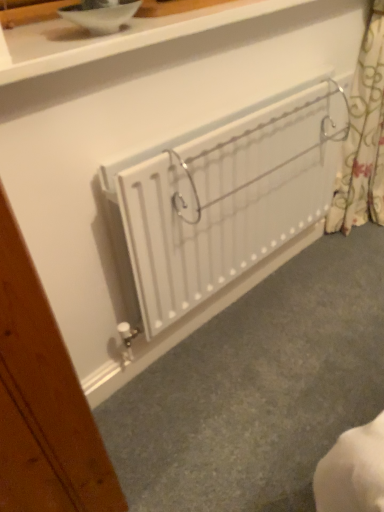
Question: Does white matte radiator at center turn towards floral fabric curtain at right?

Choices:
 (A) no
 (B) yes

Answer: (A)

Question: Considering the relative sizes of white matte radiator at center and floral fabric curtain at right in the image provided, is white matte radiator at center wider than floral fabric curtain at right?

Choices:
 (A) yes
 (B) no

Answer: (B)

Question: Does white matte radiator at center have a lesser height compared to floral fabric curtain at right?

Choices:
 (A) no
 (B) yes

Answer: (B)

Question: Considering the relative sizes of white matte radiator at center and floral fabric curtain at right in the image provided, is white matte radiator at center smaller than floral fabric curtain at right?

Choices:
 (A) yes
 (B) no

Answer: (B)

Question: Is white matte radiator at center taller than floral fabric curtain at right?

Choices:
 (A) yes
 (B) no

Answer: (B)

Question: Is white matte radiator at center not close to floral fabric curtain at right?

Choices:
 (A) yes
 (B) no

Answer: (B)

Question: Does floral fabric curtain at right have a greater height compared to white matte radiator at center?

Choices:
 (A) no
 (B) yes

Answer: (B)

Question: Considering the relative positions of floral fabric curtain at right and white matte radiator at center in the image provided, is floral fabric curtain at right to the right of white matte radiator at center from the viewer's perspective?

Choices:
 (A) no
 (B) yes

Answer: (B)

Question: From the image's perspective, is floral fabric curtain at right located beneath white matte radiator at center?

Choices:
 (A) yes
 (B) no

Answer: (B)

Question: Is floral fabric curtain at right oriented towards white matte radiator at center?

Choices:
 (A) yes
 (B) no

Answer: (B)

Question: Considering the relative positions of floral fabric curtain at right and white matte radiator at center in the image provided, is floral fabric curtain at right to the left of white matte radiator at center from the viewer's perspective?

Choices:
 (A) no
 (B) yes

Answer: (A)

Question: Is white matte radiator at center surrounded by floral fabric curtain at right?

Choices:
 (A) yes
 (B) no

Answer: (B)

Question: Would you say floral fabric curtain at right is to the left or to the right of white matte radiator at center in the picture?

Choices:
 (A) right
 (B) left

Answer: (A)